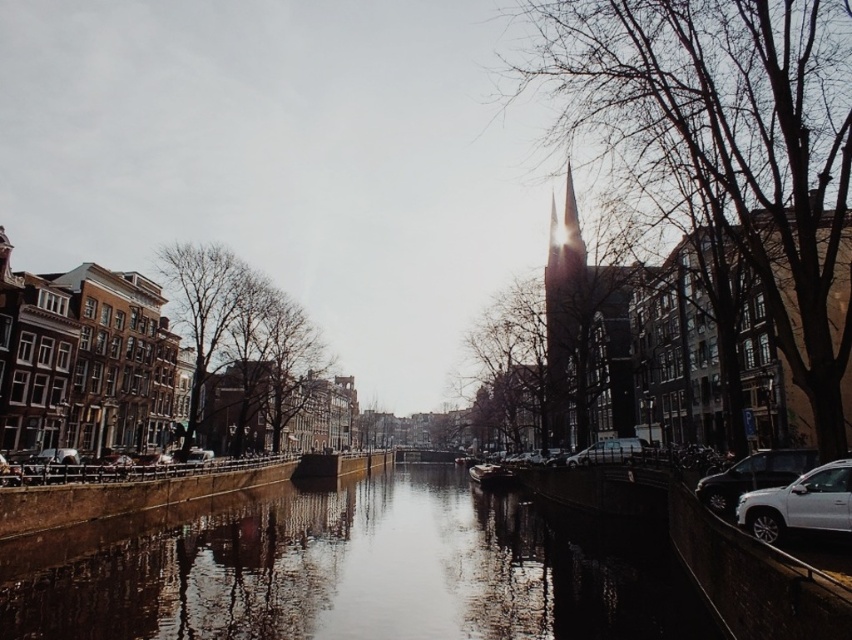
Question: Among these objects, which one is farthest from the camera?

Choices:
 (A) smooth concrete water at center
 (B) white matte suv at lower right

Answer: (A)

Question: Can you confirm if smooth concrete water at center is wider than shiny silver suv at right?

Choices:
 (A) no
 (B) yes

Answer: (B)

Question: Is smooth concrete water at center further to the viewer compared to shiny silver suv at right?

Choices:
 (A) yes
 (B) no

Answer: (B)

Question: Estimate the real-world distances between objects in this image. Which object is farther from the shiny silver suv at right?

Choices:
 (A) matte silver van at center-right
 (B) smooth concrete water at center
 (C) white matte suv at lower right

Answer: (B)

Question: Which of the following is the farthest from the observer?

Choices:
 (A) shiny glass spire at center
 (B) smooth concrete water at center
 (C) shiny silver suv at right
 (D) bare branches at left

Answer: (A)

Question: Is smooth concrete water at center further to camera compared to brown textured tree at center?

Choices:
 (A) no
 (B) yes

Answer: (A)